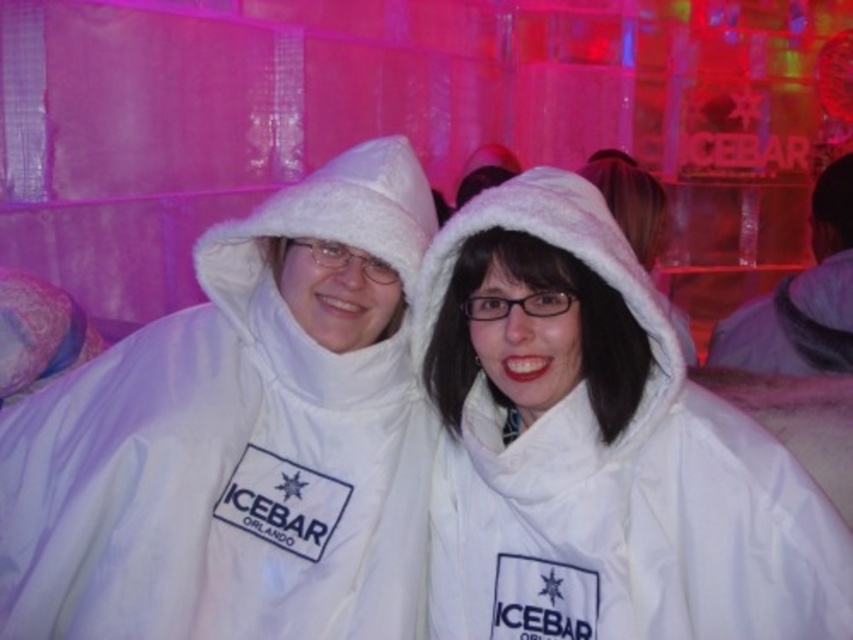
Question: Is white fleece coat at center bigger than white fleece robe at right?

Choices:
 (A) yes
 (B) no

Answer: (A)

Question: Which object is closer to the camera taking this photo?

Choices:
 (A) white fleece coat at center
 (B) white fuzzy coat at center

Answer: (A)

Question: Considering the relative positions of white fuzzy coat at center and white fleece robe at right in the image provided, where is white fuzzy coat at center located with respect to white fleece robe at right?

Choices:
 (A) left
 (B) right

Answer: (A)

Question: Which point appears closest to the camera in this image?

Choices:
 (A) (833, 272)
 (B) (488, 564)
 (C) (355, 435)

Answer: (B)

Question: Which object is positioned closest to the white fuzzy coat at center?

Choices:
 (A) white fleece coat at center
 (B) white fleece robe at right

Answer: (A)

Question: Does white fuzzy coat at center have a smaller size compared to white fleece coat at center?

Choices:
 (A) yes
 (B) no

Answer: (B)